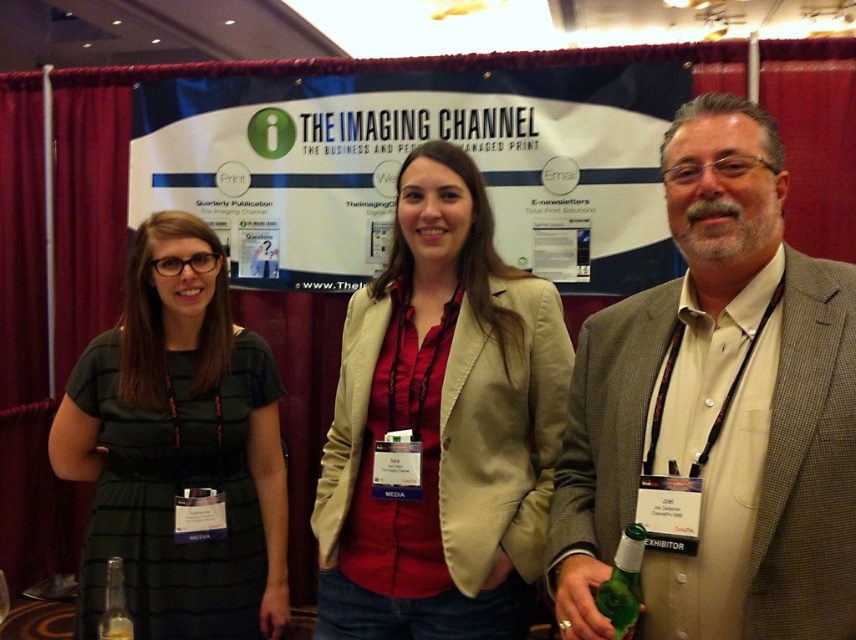
Question: Considering the relative positions of brown textured blazer at center and green glass bottle at lower right in the image provided, where is brown textured blazer at center located with respect to green glass bottle at lower right?

Choices:
 (A) above
 (B) below

Answer: (A)

Question: Does beige fabric blazer at center appear on the left side of green glass bottle at lower right?

Choices:
 (A) yes
 (B) no

Answer: (A)

Question: Which is nearer to the clear glass bottle at lower left?

Choices:
 (A) green glass bottle at lower right
 (B) brown textured blazer at center
 (C) dark green dress at left

Answer: (C)

Question: Considering the relative positions of brown textured blazer at center and dark green dress at left in the image provided, where is brown textured blazer at center located with respect to dark green dress at left?

Choices:
 (A) below
 (B) above

Answer: (B)

Question: Which object appears farthest from the camera in this image?

Choices:
 (A) brown textured blazer at center
 (B) clear glass bottle at lower left

Answer: (B)

Question: Which point is closer to the camera taking this photo?

Choices:
 (A) (170, 218)
 (B) (708, 291)
 (C) (110, 618)

Answer: (B)